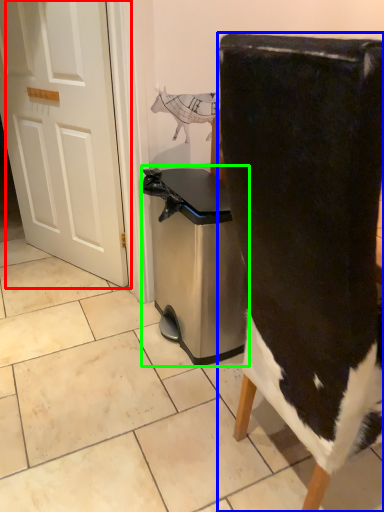
Question: Estimate the real-world distances between objects in this image. Which object is closer to door (highlighted by a red box), chair (highlighted by a blue box) or dish washer (highlighted by a green box)?

Choices:
 (A) chair
 (B) dish washer

Answer: (B)